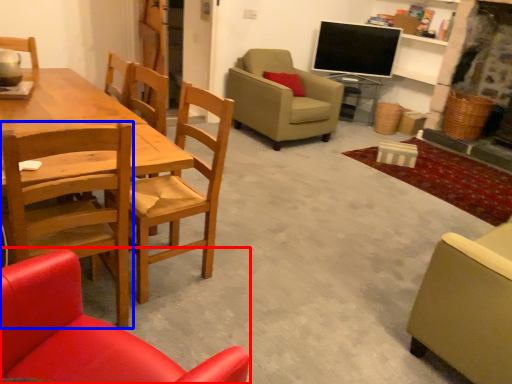
Question: Among these objects, which one is farthest to the camera, chair (highlighted by a red box) or chair (highlighted by a blue box)?

Choices:
 (A) chair
 (B) chair

Answer: (B)